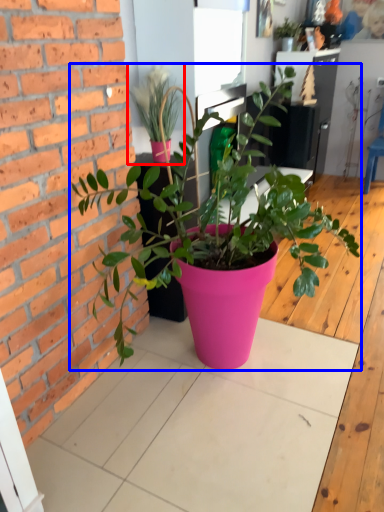
Question: Which of the following is the farthest to the observer, houseplant (highlighted by a red box) or houseplant (highlighted by a blue box)?

Choices:
 (A) houseplant
 (B) houseplant

Answer: (A)